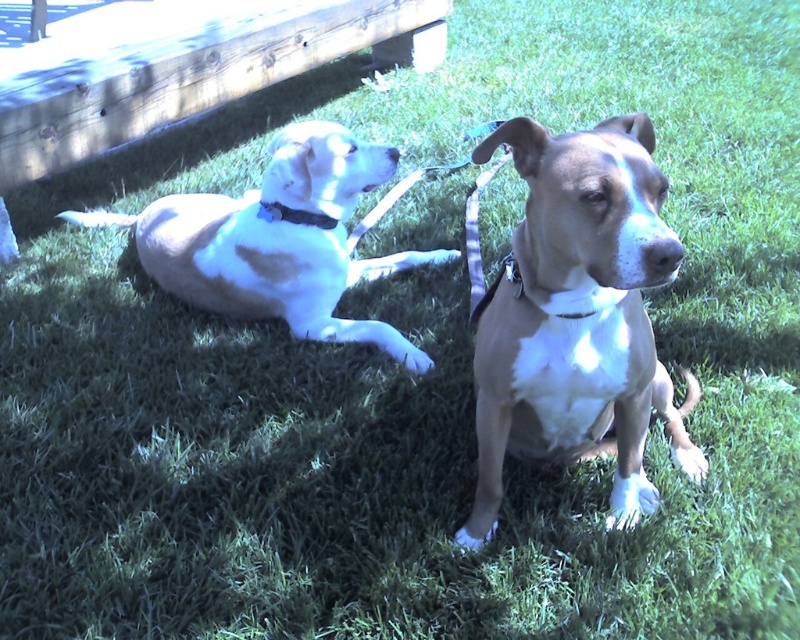
Looking at this image, can you confirm if brown matte dog at center is positioned above matte blue collar at upper left?

No.

Is point (580, 225) in front of point (277, 202)?

Yes, point (580, 225) is closer to viewer.

Who is more forward, (508, 422) or (268, 212)?

Positioned in front is point (508, 422).

The image size is (800, 640). Identify the location of brown matte dog at center. (578, 317).

You are a GUI agent. You are given a task and a screenshot of the screen. Output one action in this format:
    pyautogui.click(x=<x>, y=<y>)
    Task: Click on the light brown fur at left
    
    Given the screenshot: What is the action you would take?
    pyautogui.click(x=277, y=241)

Which is in front, point (284, 179) or point (324, 216)?

Positioned in front is point (284, 179).

Identify the location of light brown fur at left. [x=277, y=241].

Is brown matte dog at center to the left of light brown fur at left from the viewer's perspective?

In fact, brown matte dog at center is to the right of light brown fur at left.

Does brown matte dog at center come in front of light brown fur at left?

Yes, it is.

Is point (649, 177) less distant than point (302, 154)?

Yes, point (649, 177) is closer to viewer.

Find the location of a particular element. The width and height of the screenshot is (800, 640). brown matte dog at center is located at coordinates (578, 317).